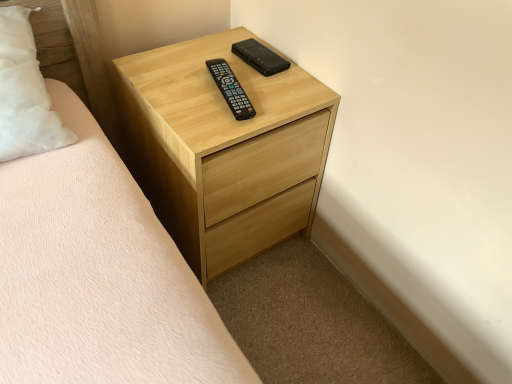
What are the coordinates of `vacant space situated above light wood chest of drawers at center (from a real-world perspective)` in the screenshot? It's located at (224, 92).